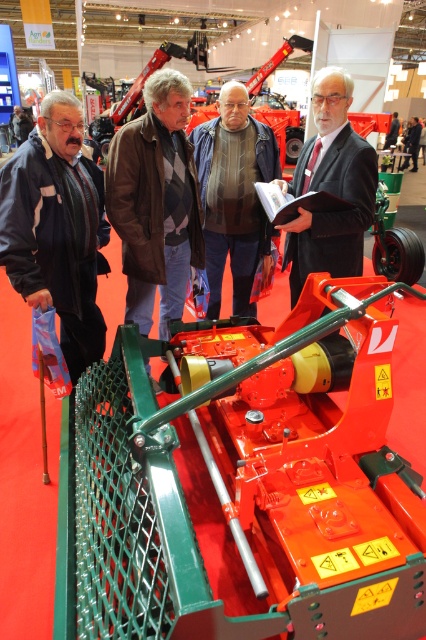
Does brown woolen coat at center appear on the left side of brown leather jacket at center?

Correct, you'll find brown woolen coat at center to the left of brown leather jacket at center.

Who is positioned more to the left, brown woolen coat at center or brown leather jacket at center?

brown woolen coat at center is more to the left.

Where is `brown woolen coat at center`? The image size is (426, 640). brown woolen coat at center is located at coordinates (155, 202).

Between dark blue jacket at left and brown leather jacket at center, which one appears on the right side from the viewer's perspective?

brown leather jacket at center

Can you confirm if dark blue jacket at left is shorter than brown leather jacket at center?

Yes, dark blue jacket at left is shorter than brown leather jacket at center.

This screenshot has height=640, width=426. Identify the location of dark blue jacket at left. (57, 227).

Can you confirm if dark blue jacket at left is positioned to the right of matte black suit at center?

In fact, dark blue jacket at left is to the left of matte black suit at center.

Does dark blue jacket at left appear on the left side of matte black suit at center?

Correct, you'll find dark blue jacket at left to the left of matte black suit at center.

This screenshot has height=640, width=426. Find the location of `dark blue jacket at left`. dark blue jacket at left is located at coordinates (57, 227).